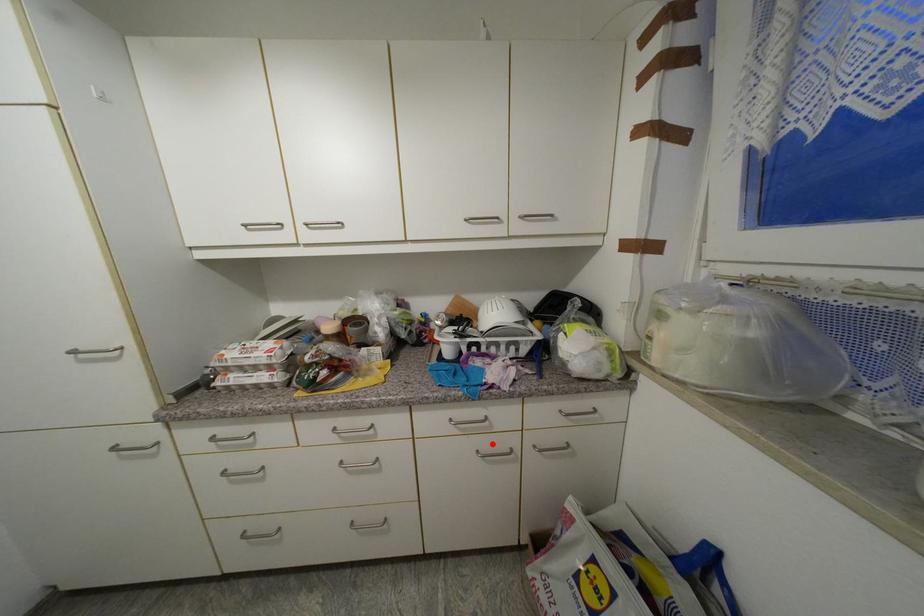
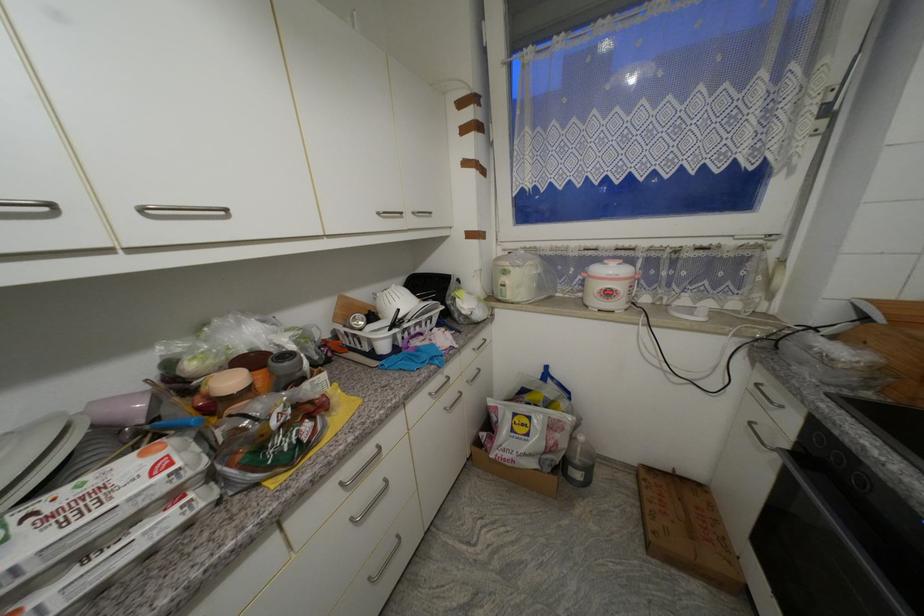
Find the pixel in the second image that matches the highlighted location in the first image.

(455, 398)